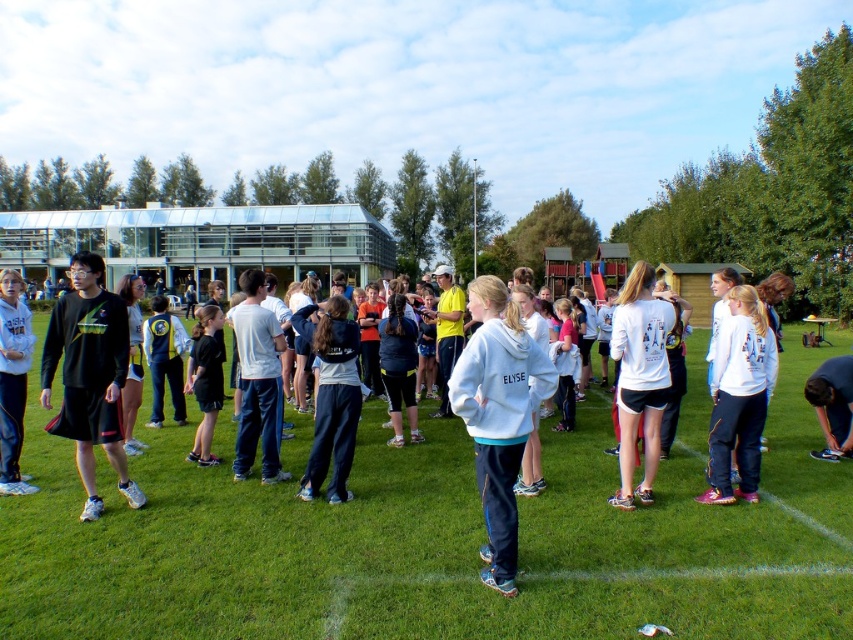
Question: Which is farther from the black matte long-sleeve shirt at center?

Choices:
 (A) black matte shorts at center
 (B) white fleece jacket at center
 (C) green grass at center

Answer: (C)

Question: Can you confirm if green grass at center is positioned above black matte long-sleeve shirt at center?

Choices:
 (A) yes
 (B) no

Answer: (B)

Question: Which object is positioned farthest from the black matte shorts at center?

Choices:
 (A) black matte long-sleeve shirt at center
 (B) green grass at center

Answer: (B)

Question: Which object appears closest to the camera in this image?

Choices:
 (A) black matte long-sleeve shirt at center
 (B) black matte shorts at center

Answer: (A)

Question: Where is green grass at center located in relation to black matte shorts at center in the image?

Choices:
 (A) left
 (B) right

Answer: (B)

Question: From the image, what is the correct spatial relationship of black matte long-sleeve shirt at center in relation to black matte shorts at center?

Choices:
 (A) below
 (B) above

Answer: (A)